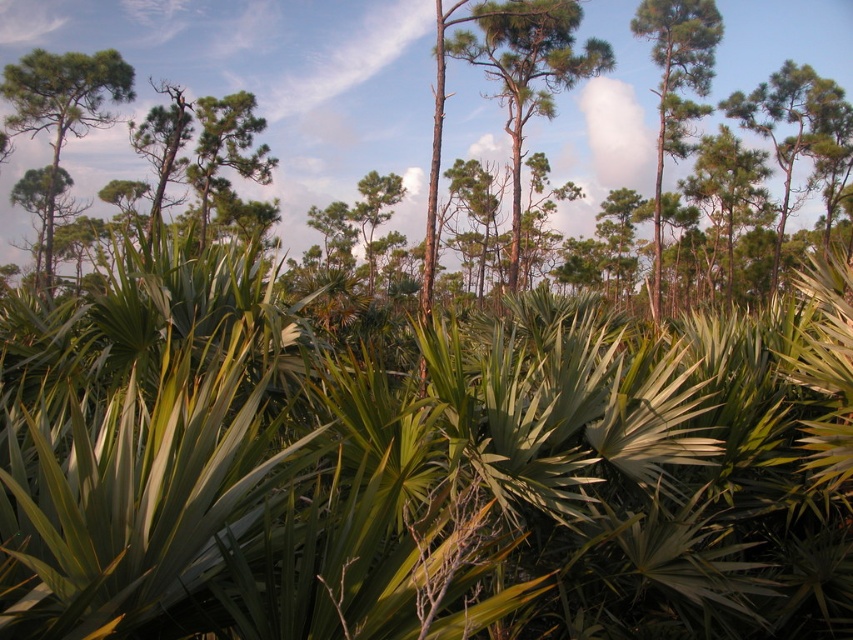
Based on the photo, you are a hiker standing in the forest and want to climb the tallest tree. Which tree should you choose between the green matte tree at upper left and the green matte tree at upper right?

The green matte tree at upper right is taller than the green matte tree at upper left, so you should choose the green matte tree at upper right.

You are a hiker trying to navigate through the forest. You see a green textured pine tree at center and a green matte tree at upper right. Which tree is closer to you?

The green textured pine tree at center is closer to the viewer than the green matte tree at upper right.